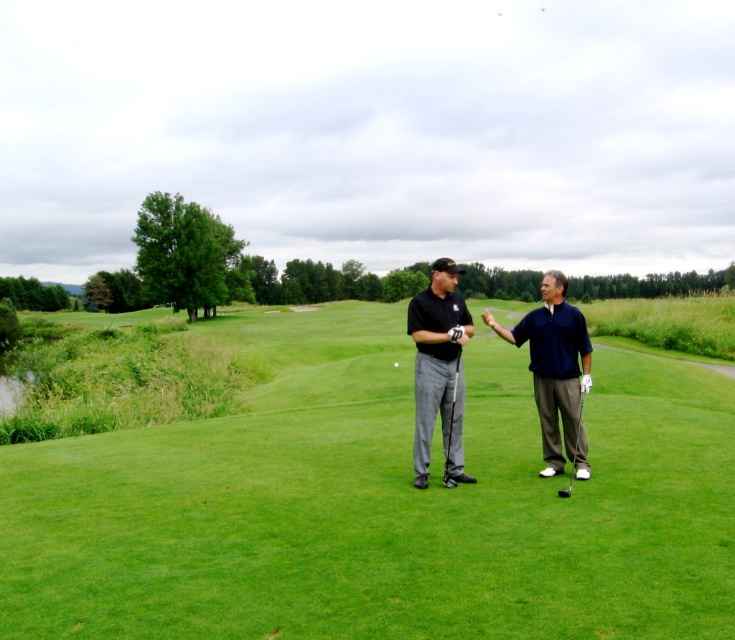
You are a photographer positioned behind the two golfers. You want to capture a photo where the matte black shirt at center is partially hidden behind the metallic silver golf club at center. Is this possible based on their current positions?

The matte black shirt at center has a lesser height compared to metallic silver golf club at center, so yes, the photographer can position themselves to have the matte black shirt at center partially hidden behind the metallic silver golf club at center since the club is taller.

You are a golfer standing on the green and want to hit the white matte golf ball at center. However, there is a matte black shirt at center in the way. Can you hit the ball without moving the shirt?

The matte black shirt at center is positioned over the white matte golf ball at center, so you cannot hit the ball without moving the shirt because it is directly covering the ball.

You are a golfer standing on the green and want to hit the white matte golf ball at center. There is a matte black shirt at center in your way. Can you adjust your swing to avoid hitting the shirt?

The matte black shirt at center might be wider than the white matte golf ball at center, so you need to adjust your swing to avoid the wider area of the shirt.